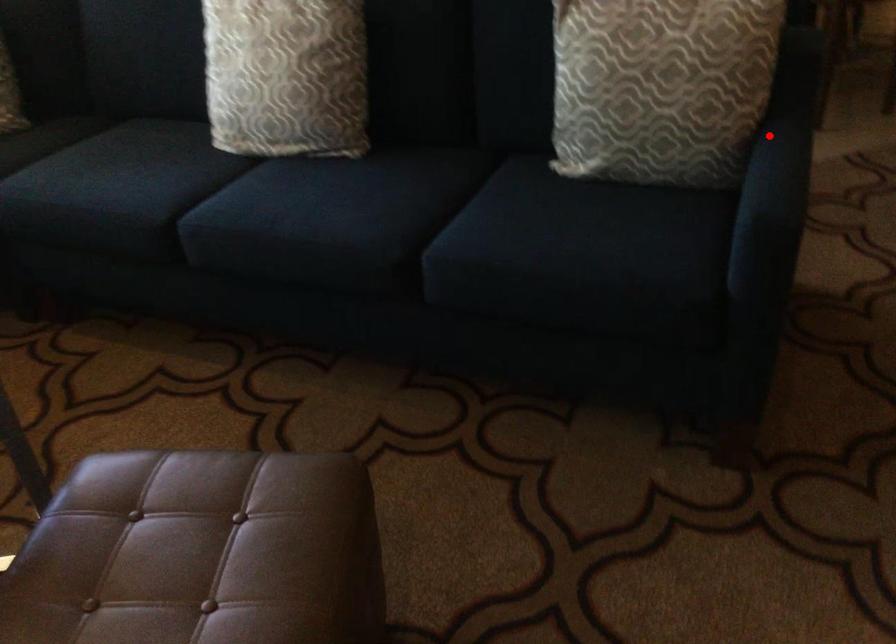
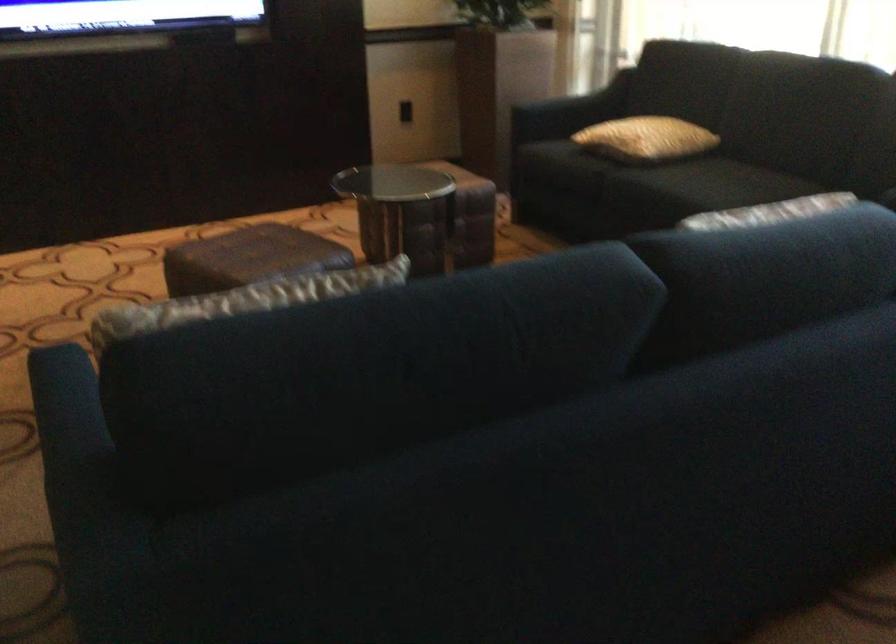
Where in the second image is the point corresponding to the highlighted location from the first image?

(69, 431)